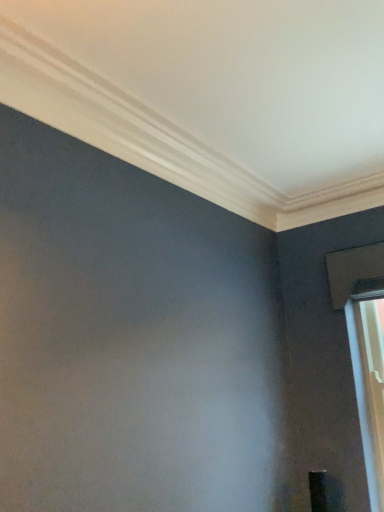
Where is `clear glass window at right`? The width and height of the screenshot is (384, 512). clear glass window at right is located at coordinates (364, 347).

What do you see at coordinates (364, 347) in the screenshot? The width and height of the screenshot is (384, 512). I see `clear glass window at right` at bounding box center [364, 347].

Identify the location of clear glass window at right. The height and width of the screenshot is (512, 384). (364, 347).